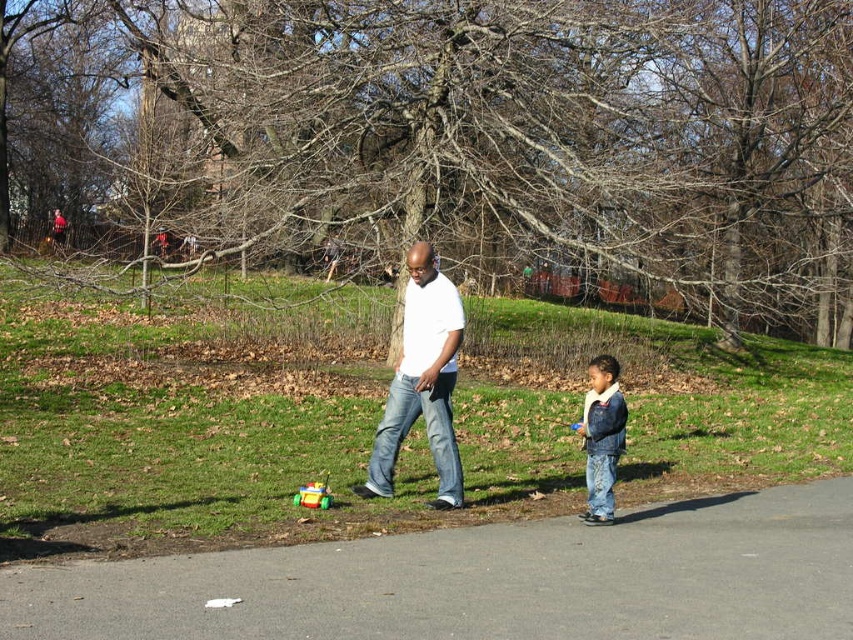
You are planning to place a picnic blanket in the park. Based on the scene, which area would be more suitable for a picnic between the green grass at center and the gray asphalt pavement at lower center? Explain your reasoning.

The green grass at center is bigger than the gray asphalt pavement at lower center, making it a more suitable area for a picnic as it provides a larger space to spread out the blanket comfortably.

You are a photographer planning to take a picture of the green grass at center and the white matte shirt at center. Which object will appear wider in the photo?

The green grass at center will appear wider in the photo because its width is larger than that of the white matte shirt at center.